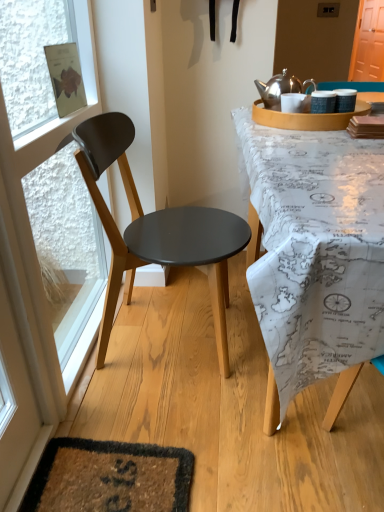
Describe the element at coordinates (281, 88) in the screenshot. I see `shiny metallic kettle at upper right` at that location.

The width and height of the screenshot is (384, 512). What are the coordinates of `transparent glass door at left` in the screenshot? It's located at coord(49,194).

Identify the location of matte black chair at left. (156, 229).

From a real-world perspective, is transparent glass door at left located higher than shiny metallic kettle at upper right?

No, from a real-world perspective, transparent glass door at left is not on top of shiny metallic kettle at upper right.

In the image, there is a shiny metallic kettle at upper right. At what (x,y) coordinates should I click in order to perform the action: click on glass door below it (from the image's perspective). Please return your answer as a coordinate pair (x, y). The width and height of the screenshot is (384, 512). Looking at the image, I should click on (49, 194).

Is transparent glass door at left not close to shiny metallic kettle at upper right?

No, transparent glass door at left is not far away from shiny metallic kettle at upper right.

Based on the photo, from the image's perspective, is matte black chair at left above or below orange wood screen door at upper right?

matte black chair at left is situated lower than orange wood screen door at upper right in the image.

Which is behind, point (147, 257) or point (370, 13)?

Point (370, 13)

Measure the distance between matte black chair at left and orange wood screen door at upper right.

A distance of 7.75 feet exists between matte black chair at left and orange wood screen door at upper right.

How many degrees apart are the facing directions of matte black chair at left and orange wood screen door at upper right?

There is a 180-degree angle between the facing directions of matte black chair at left and orange wood screen door at upper right.

Are orange wood screen door at upper right and shiny metallic kettle at upper right far apart?

Yes, orange wood screen door at upper right is far from shiny metallic kettle at upper right.

Measure the distance between orange wood screen door at upper right and shiny metallic kettle at upper right.

They are 5.37 feet apart.

Between orange wood screen door at upper right and shiny metallic kettle at upper right, which one has less height?

shiny metallic kettle at upper right is shorter.

Looking at their sizes, would you say orange wood screen door at upper right is wider or thinner than shiny metallic kettle at upper right?

orange wood screen door at upper right is thinner than shiny metallic kettle at upper right.

In terms of height, does transparent glass door at left look taller or shorter compared to orange wood screen door at upper right?

In the image, transparent glass door at left appears to be taller than orange wood screen door at upper right.

Looking at the image, does transparent glass door at left seem bigger or smaller compared to orange wood screen door at upper right?

transparent glass door at left is bigger than orange wood screen door at upper right.

Looking at their sizes, would you say transparent glass door at left is wider or thinner than orange wood screen door at upper right?

Considering their sizes, transparent glass door at left looks slimmer than orange wood screen door at upper right.

From the image's perspective, which is below, transparent glass door at left or matte black chair at left?

matte black chair at left, from the image's perspective.

Is point (57, 294) closer or farther from the camera than point (100, 173)?

Point (57, 294) is positioned farther from the camera compared to point (100, 173).

Based on the photo, considering the sizes of objects transparent glass door at left and matte black chair at left in the image provided, who is shorter, transparent glass door at left or matte black chair at left?

With less height is matte black chair at left.

Is transparent glass door at left not inside matte black chair at left?

Yes, transparent glass door at left is located beyond the bounds of matte black chair at left.

Is orange wood screen door at upper right thinner than matte black chair at left?

Correct, the width of orange wood screen door at upper right is less than that of matte black chair at left.

Considering the relative sizes of orange wood screen door at upper right and matte black chair at left in the image provided, is orange wood screen door at upper right smaller than matte black chair at left?

Yes, orange wood screen door at upper right is smaller than matte black chair at left.

You are a GUI agent. You are given a task and a screenshot of the screen. Output one action in this format:
    pyautogui.click(x=<x>, y=<y>)
    Task: Click on the chair that appears on the left of orange wood screen door at upper right
    The image size is (384, 512).
    Given the screenshot: What is the action you would take?
    pyautogui.click(x=156, y=229)

Does point (366, 59) appear closer or farther from the camera than point (236, 223)?

Point (366, 59) is positioned farther from the camera compared to point (236, 223).

Is point (259, 81) behind point (365, 42)?

No.

Is shiny metallic kettle at upper right looking in the opposite direction of orange wood screen door at upper right?

No, shiny metallic kettle at upper right is not facing the opposite direction of orange wood screen door at upper right.

Is shiny metallic kettle at upper right taller or shorter than orange wood screen door at upper right?

Clearly, shiny metallic kettle at upper right is shorter compared to orange wood screen door at upper right.

Consider the image. Is orange wood screen door at upper right located within shiny metallic kettle at upper right?

Actually, orange wood screen door at upper right is outside shiny metallic kettle at upper right.

The image size is (384, 512). Identify the location of glass door that is under the shiny metallic kettle at upper right (from a real-world perspective). (49, 194).

Image resolution: width=384 pixels, height=512 pixels. What are the coordinates of `screen door above the matte black chair at left (from a real-world perspective)` in the screenshot? It's located at (368, 42).

From the image, which object appears to be nearer to matte black chair at left, shiny metallic kettle at upper right or orange wood screen door at upper right?

shiny metallic kettle at upper right is positioned closer to the anchor matte black chair at left.

Estimate the real-world distances between objects in this image. Which object is further from orange wood screen door at upper right, shiny metallic kettle at upper right or matte black chair at left?

The object further to orange wood screen door at upper right is matte black chair at left.

Looking at the image, which one is located closer to orange wood screen door at upper right, transparent glass door at left or shiny metallic kettle at upper right?

shiny metallic kettle at upper right lies closer to orange wood screen door at upper right than the other object.

Looking at this image, estimate the real-world distances between objects in this image. Which object is further from matte black chair at left, orange wood screen door at upper right or shiny metallic kettle at upper right?

The object further to matte black chair at left is orange wood screen door at upper right.

Based on their spatial positions, is matte black chair at left or orange wood screen door at upper right further from transparent glass door at left?

The object further to transparent glass door at left is orange wood screen door at upper right.

From the picture: Based on their spatial positions, is transparent glass door at left or shiny metallic kettle at upper right closer to matte black chair at left?

transparent glass door at left is closer to matte black chair at left.

Which object lies further to the anchor point shiny metallic kettle at upper right, matte black chair at left or transparent glass door at left?

transparent glass door at left is positioned further to the anchor shiny metallic kettle at upper right.

Considering their positions, is transparent glass door at left positioned further to matte black chair at left than orange wood screen door at upper right?

orange wood screen door at upper right lies further to matte black chair at left than the other object.

Identify the location of chair between transparent glass door at left and shiny metallic kettle at upper right in the front-back direction. (156, 229).

The height and width of the screenshot is (512, 384). I want to click on kettle between matte black chair at left and orange wood screen door at upper right along the z-axis, so click(x=281, y=88).

I want to click on chair located between transparent glass door at left and orange wood screen door at upper right in the depth direction, so click(156, 229).

The width and height of the screenshot is (384, 512). Identify the location of kettle between transparent glass door at left and orange wood screen door at upper right in the front-back direction. (281, 88).